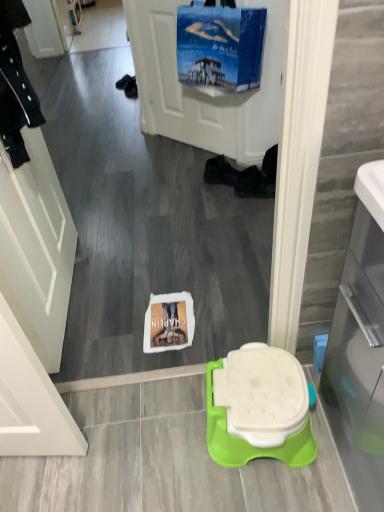
Question: From their relative heights in the image, would you say blue fabric screen door at upper center, arranged as the first screen door when viewed from the back, is taller or shorter than transparent glass door at right?

Choices:
 (A) short
 (B) tall

Answer: (B)

Question: Is point (152, 52) closer or farther from the camera than point (349, 455)?

Choices:
 (A) farther
 (B) closer

Answer: (A)

Question: Based on their relative distances, which object is farther from the blue fabric screen door at upper center, which is the second screen door in front-to-back order?

Choices:
 (A) white matte screen door at left, which ranks as the first screen door in left-to-right order
 (B) transparent glass door at right
 (C) white plastic toilet at center
 (D) black fabric shoe at center, which is counted as the second footwear, starting from the left
 (E) black fabric shoe at center, which is the second footwear from right to left

Answer: (B)

Question: Based on their relative distances, which object is nearer to the transparent glass door at right?

Choices:
 (A) white plastic toilet at center
 (B) blue fabric screen door at upper center, the first screen door when ordered from right to left
 (C) black fabric shoe at center, which is the second footwear from right to left
 (D) white matte screen door at left, arranged as the first screen door when viewed from the front
 (E) black fabric shoe at center, acting as the first footwear starting from the right

Answer: (A)